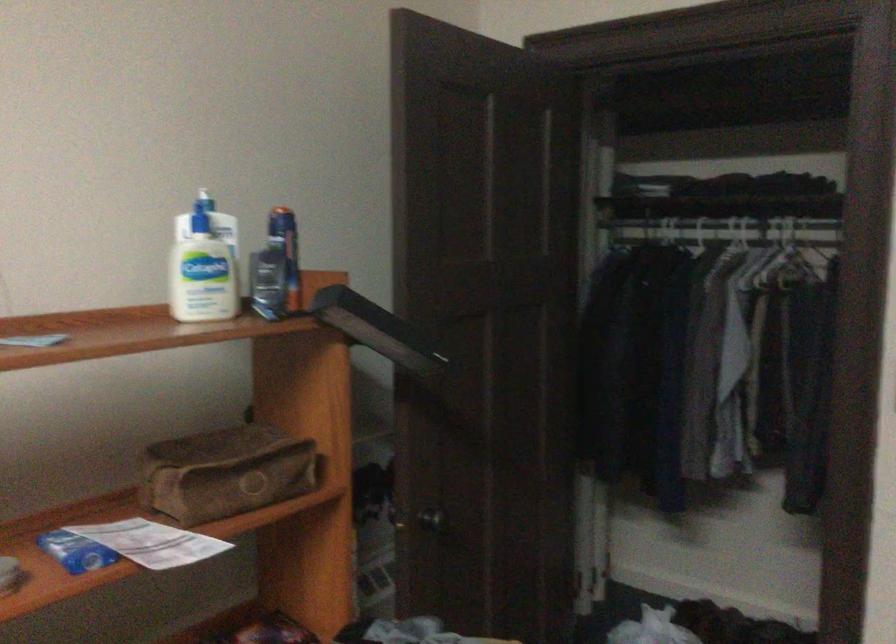
The width and height of the screenshot is (896, 644). What do you see at coordinates (203, 265) in the screenshot?
I see `a spray can nozzle` at bounding box center [203, 265].